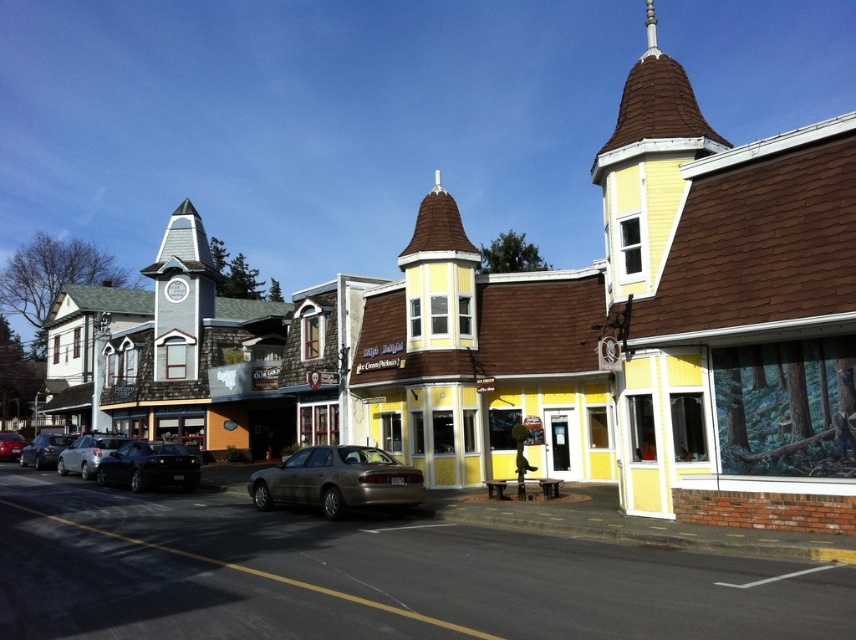
You are a pedestrian standing on the sidewalk and want to cross the street to reach the building with the red brick base and forest mural. There are two cars in your path. Which car should you move around first, the gold metallic sedan at center or the satin silver sedan at left?

You should move around the satin silver sedan at left first because the gold metallic sedan at center is positioned to the right of it, so the satin silver sedan at left is closer to your starting position on the sidewalk.

You are a delivery person needing to park your vehicle between the satin silver sedan at left and the matte black sedan at left. Which direction should you drive to position your car between them?

The satin silver sedan at left is above the matte black sedan at left, so you should drive downward to position your car between them.